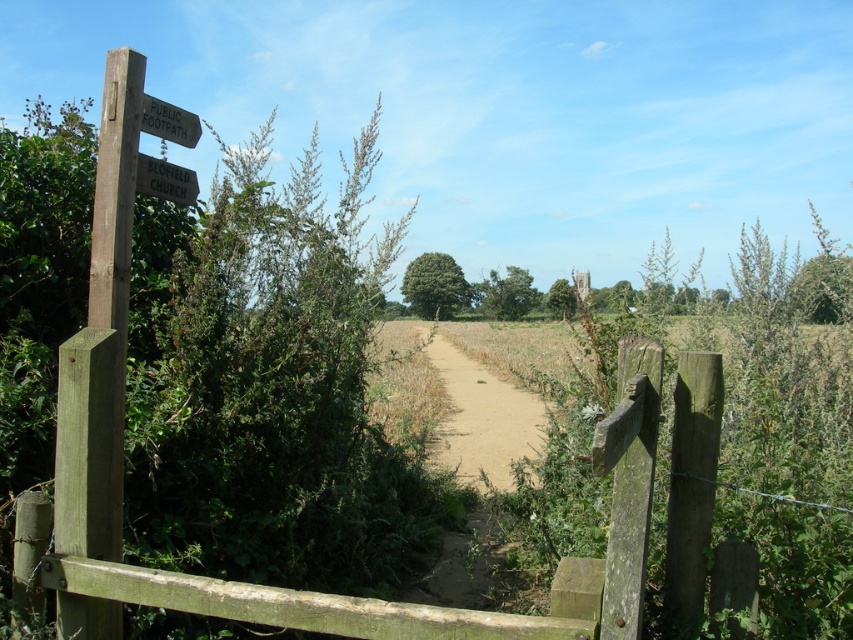
You are a hiker carrying a backpack and need to pass through the wooden gate. There are two wooden signposts near the gate. How far apart are the wooden signpost at left and the wooden signpost at upper left?

The wooden signpost at left and the wooden signpost at upper left are 6.94 inches apart from each other.

You are standing in front of the wooden gate and want to read both signs on the wooden signpost at left and the wooden signpost at upper left. Which sign do you need to look down at first?

The wooden signpost at left is below the wooden signpost at upper left, so you need to look down at the wooden signpost at left first before looking up to the wooden signpost at upper left.

You are standing at the entrance of the field and need to locate the wooden gate at center. According to the coordinates provided, where exactly should you look to find it?

The wooden gate at center is located at point [314,592].